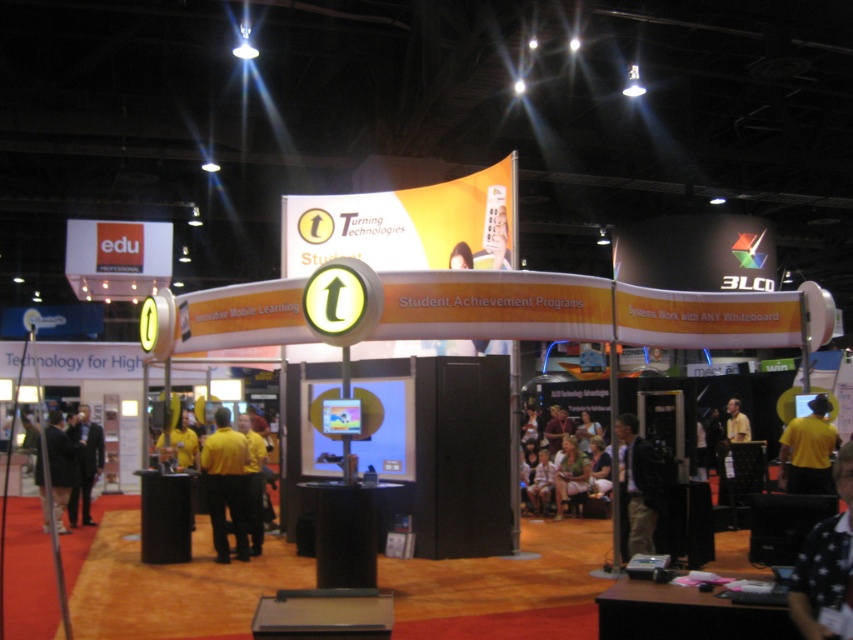
Question: From the image, what is the correct spatial relationship of yellow shirt at lower left in relation to light green fabric shirt at center?

Choices:
 (A) below
 (B) above

Answer: (B)

Question: Considering the real-world distances, which object is farthest from the light brown fabric chair at center?

Choices:
 (A) white dotted shirt at lower right
 (B) yellow shirt at lower right
 (C) light green fabric shirt at center
 (D) black leather jacket at center

Answer: (A)

Question: Can you confirm if black leather jacket at center is bigger than dark gray suit at lower left?

Choices:
 (A) yes
 (B) no

Answer: (B)

Question: Can you confirm if yellow shirt at lower left is positioned to the left of light green fabric shirt at center?

Choices:
 (A) no
 (B) yes

Answer: (B)

Question: Among these points, which one is nearest to the camera?

Choices:
 (A) (250, 476)
 (B) (556, 515)

Answer: (A)

Question: Which point appears closest to the camera in this image?

Choices:
 (A) (633, 532)
 (B) (581, 474)
 (C) (253, 490)
 (D) (57, 442)

Answer: (A)